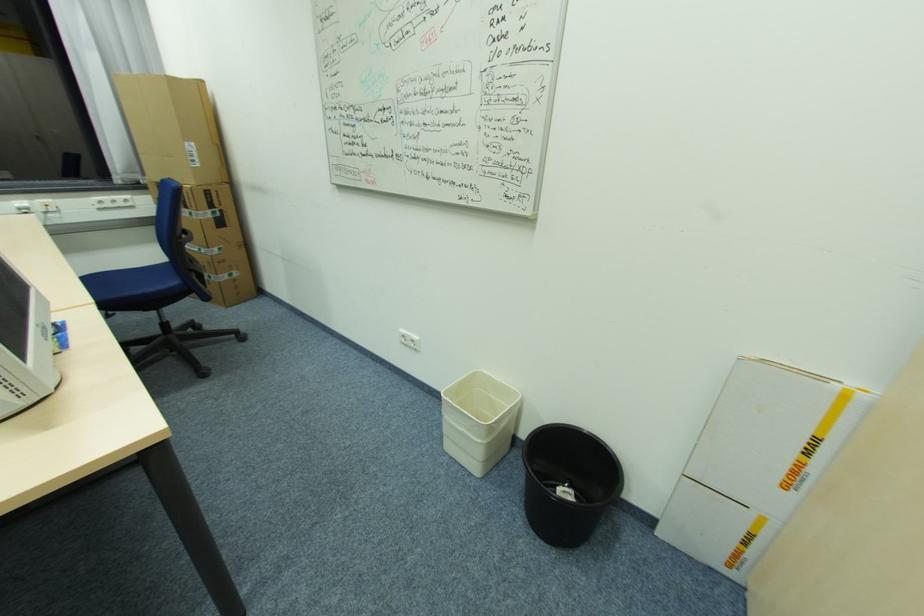
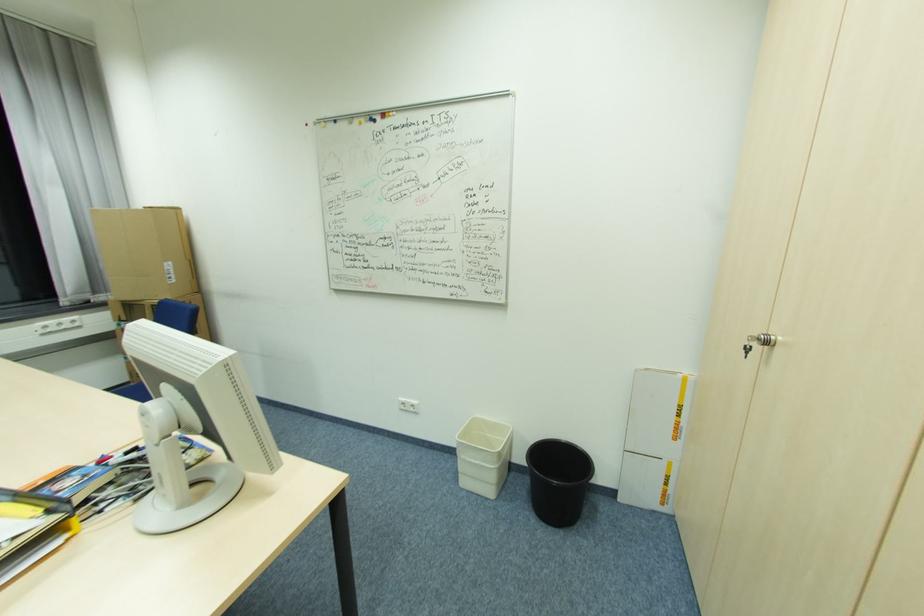
The point at (446, 437) is marked in the first image. Where is the corresponding point in the second image?

(463, 475)